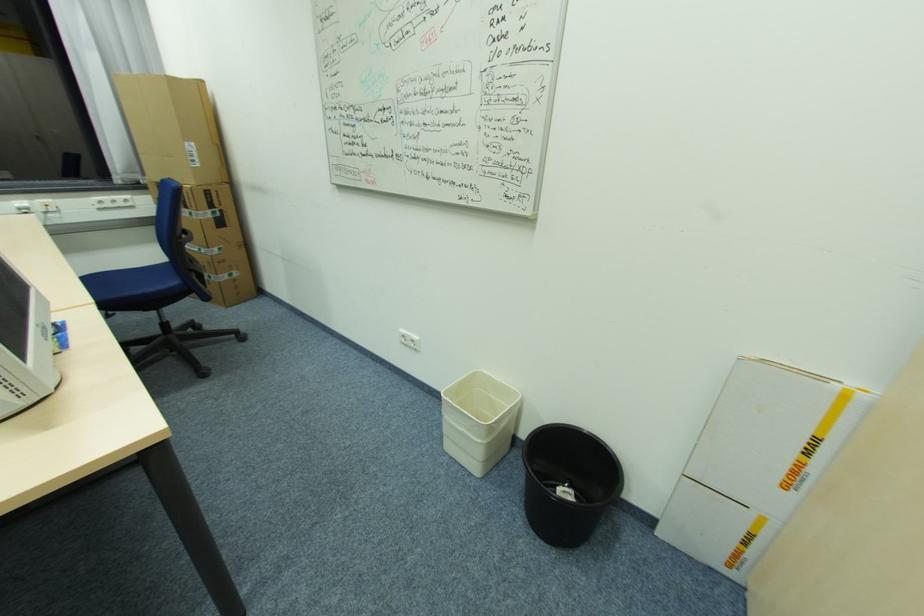
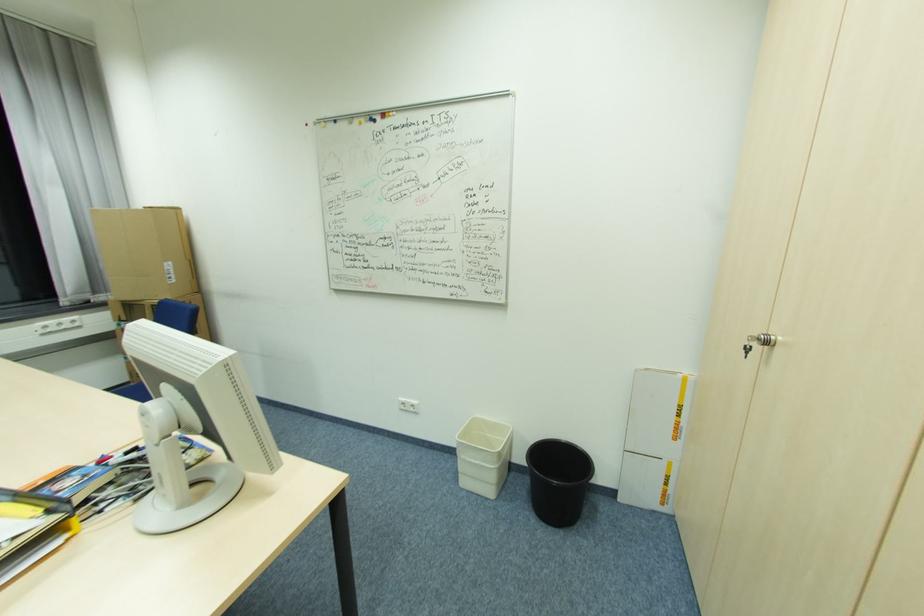
The point at (446, 437) is marked in the first image. Where is the corresponding point in the second image?

(463, 475)